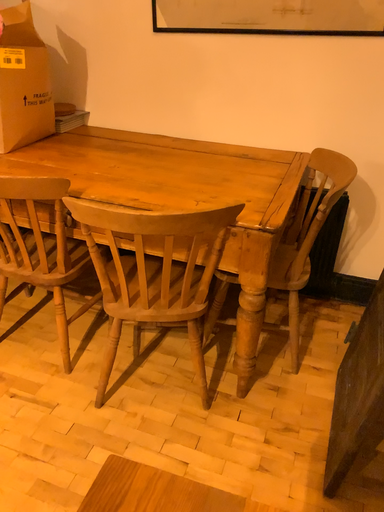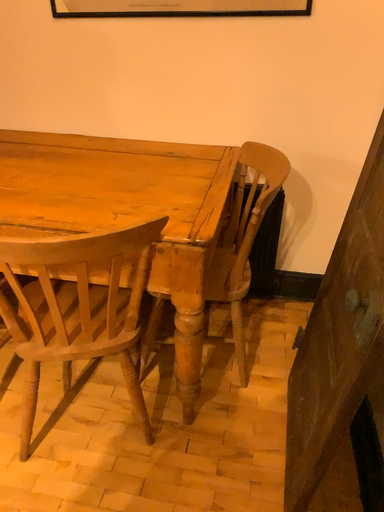
Question: How did the camera likely rotate when shooting the video?

Choices:
 (A) rotated left
 (B) rotated right

Answer: (B)